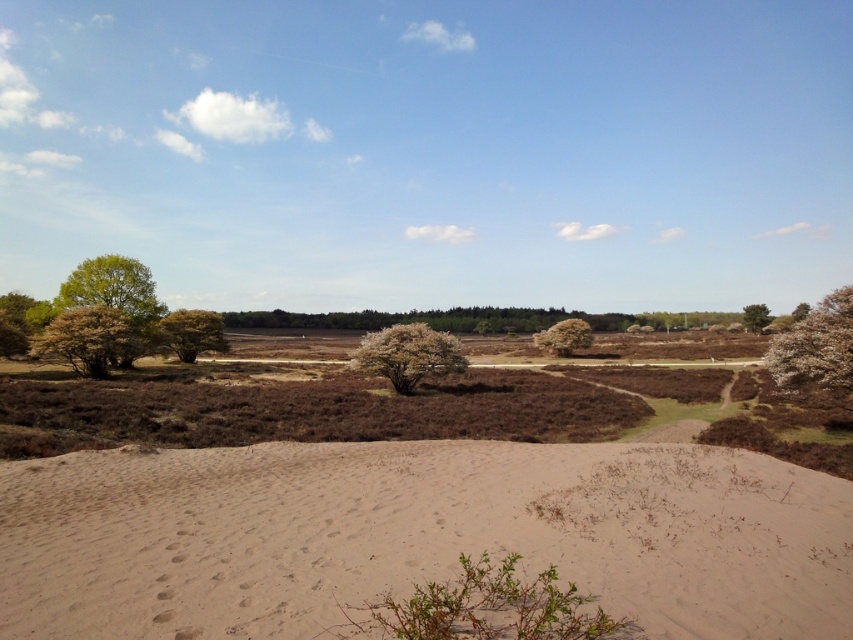
Who is more forward, (837,616) or (74,342)?

Point (837,616) is more forward.

Describe the element at coordinates (416, 536) in the screenshot. I see `light brown sandy dunes at lower left` at that location.

The width and height of the screenshot is (853, 640). In order to click on light brown sandy dunes at lower left in this screenshot , I will do `click(416, 536)`.

Is green leafy tree at center below white textured tree at upper right?

Correct, green leafy tree at center is located below white textured tree at upper right.

Can you confirm if green leafy tree at center is positioned above white textured tree at upper right?

No, green leafy tree at center is not above white textured tree at upper right.

Locate an element on the screen. green leafy tree at center is located at coordinates (564, 337).

Image resolution: width=853 pixels, height=640 pixels. In order to click on green leafy tree at center in this screenshot , I will do `click(564, 337)`.

Can you confirm if green leafy bush at left is smaller than green leafy tree at center?

Yes, green leafy bush at left is smaller than green leafy tree at center.

Is point (138, 332) more distant than point (543, 340)?

No, it is in front of (543, 340).

Locate an element on the screen. green leafy bush at left is located at coordinates (90, 339).